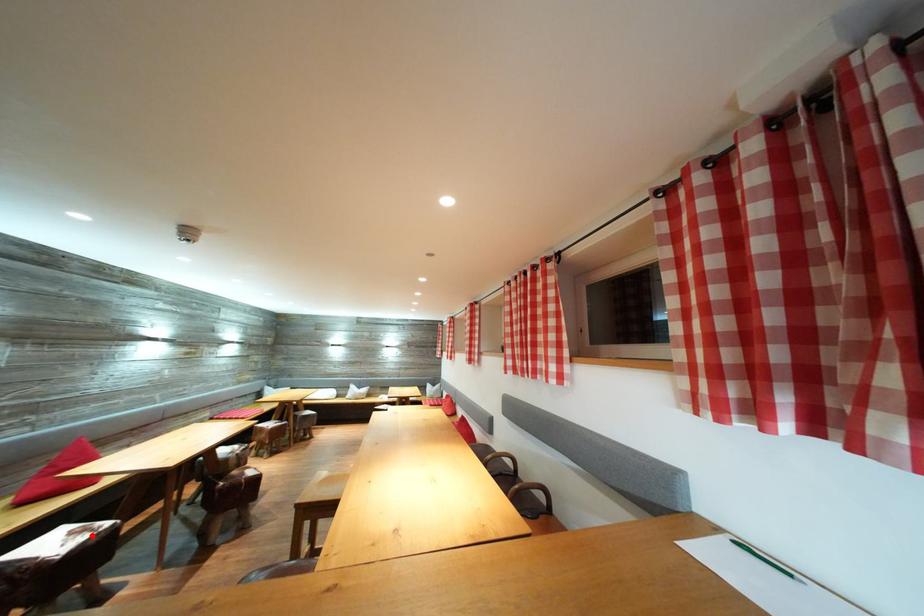
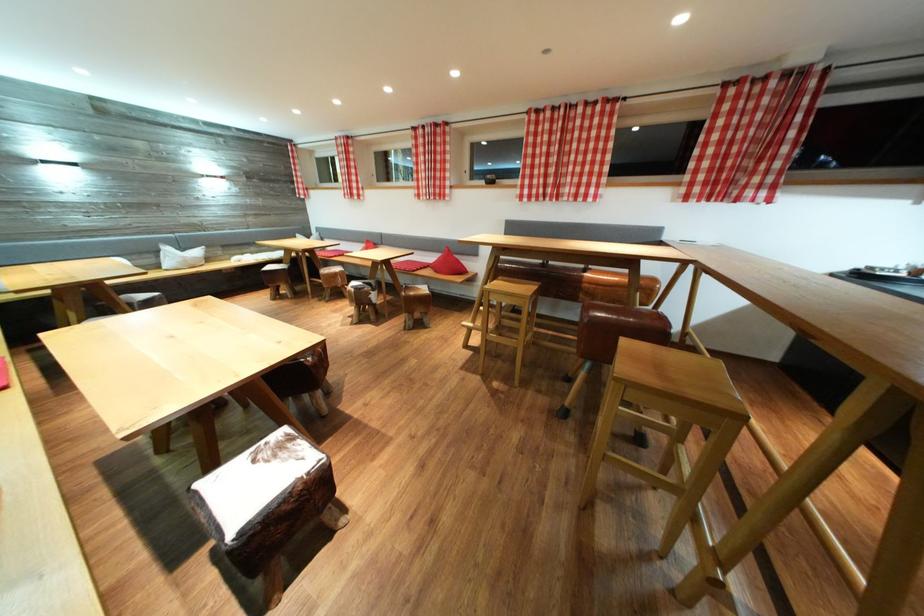
Question: A red point is marked in image1. In image2, is the corresponding 3D point closer to the camera or farther? Reply with the corresponding letter.

Choices:
 (A) The corresponding 3D point is closer.
 (B) The corresponding 3D point is farther.

Answer: (A)